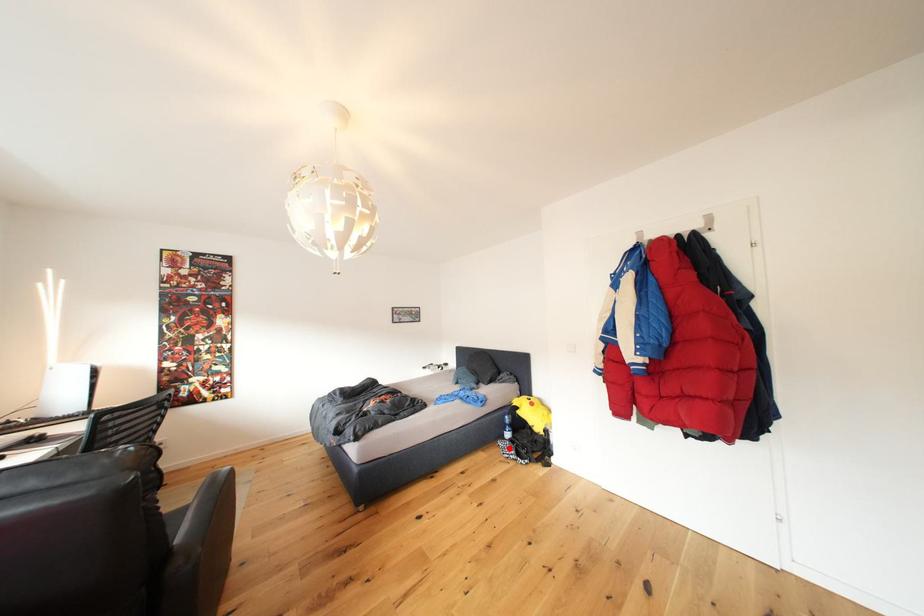
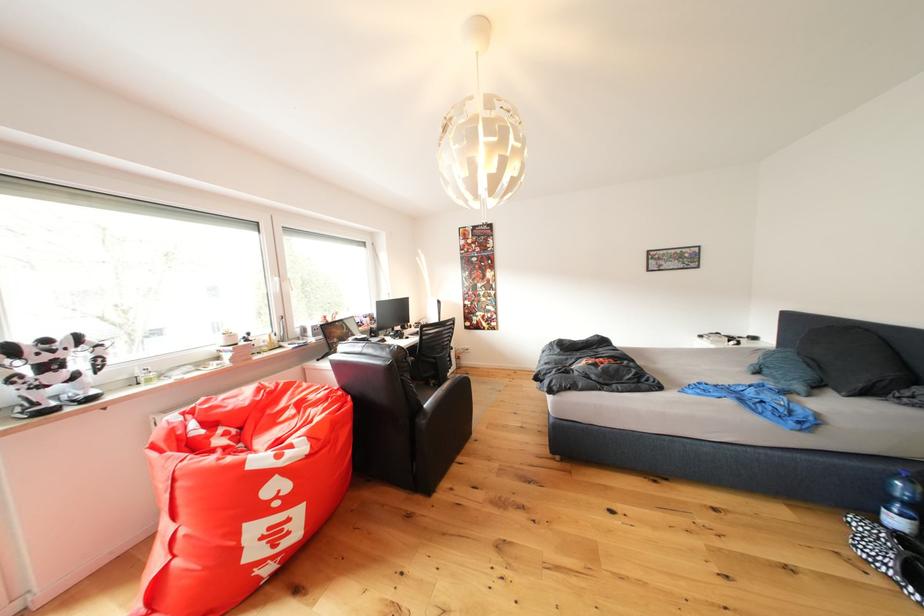
Question: I am providing you with two images of the same scene from different viewpoints. A red point is shown in image1. For the corresponding object point in image2, is it positioned nearer or farther from the camera?

Choices:
 (A) Nearer
 (B) Farther

Answer: (A)